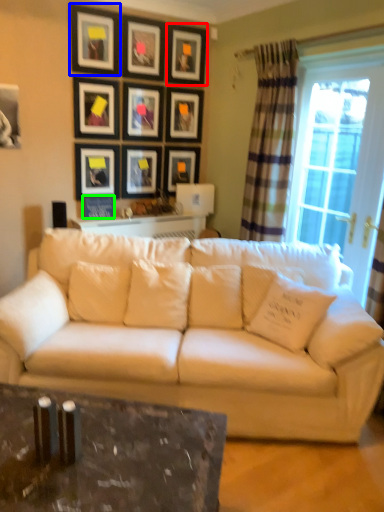
Question: Estimate the real-world distances between objects in this image. Which object is closer to picture frame (highlighted by a red box), picture frame (highlighted by a blue box) or picture frame (highlighted by a green box)?

Choices:
 (A) picture frame
 (B) picture frame

Answer: (A)